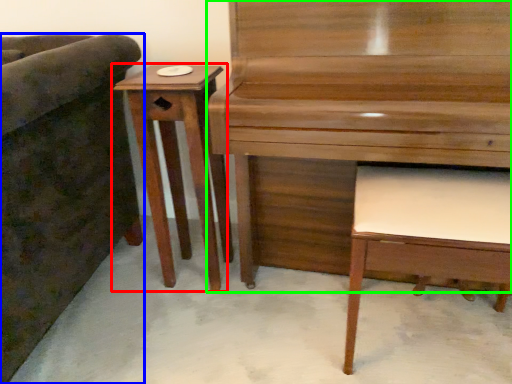
Question: Which object is the farthest from table (highlighted by a red box)? Choose among these: furniture (highlighted by a blue box) or piano (highlighted by a green box).

Choices:
 (A) furniture
 (B) piano

Answer: (B)